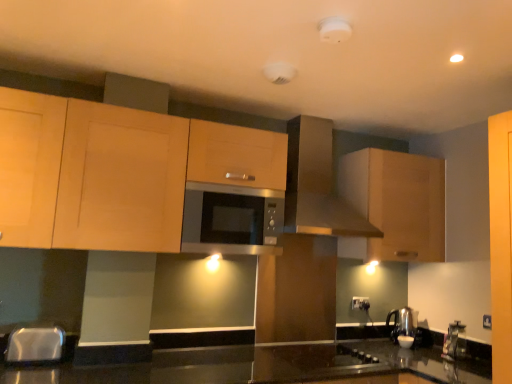
The height and width of the screenshot is (384, 512). What do you see at coordinates (116, 172) in the screenshot? I see `light wood cabinet at upper center, the second cabinetry positioned from the right` at bounding box center [116, 172].

You are a GUI agent. You are given a task and a screenshot of the screen. Output one action in this format:
    pyautogui.click(x=<x>, y=<y>)
    Task: Click on the matte brown range hood at upper center
    The width and height of the screenshot is (512, 384).
    Given the screenshot: What is the action you would take?
    pyautogui.click(x=317, y=184)

Describe the element at coordinates (405, 341) in the screenshot. I see `white glossy kettle at lower right` at that location.

What is the approximate height of matte wood cabinet at upper right, placed as the second cabinetry when sorted from left to right?

It is 29.44 inches.

This screenshot has height=384, width=512. What are the coordinates of `light wood cabinet at upper center, which is the first cabinetry from left to right` in the screenshot? It's located at (116, 172).

From a real-world perspective, is satin silver microwave at center above or below light wood cabinet at upper center, which is the first cabinetry from left to right?

satin silver microwave at center is situated lower than light wood cabinet at upper center, which is the first cabinetry from left to right, in the real world.

Which of these two, satin silver microwave at center or light wood cabinet at upper center, which is the first cabinetry from left to right, stands taller?

With more height is light wood cabinet at upper center, which is the first cabinetry from left to right.

This screenshot has width=512, height=384. In order to click on microwave below the light wood cabinet at upper center, which is the first cabinetry from left to right (from the image's perspective) in this screenshot , I will do `click(231, 220)`.

From their relative heights in the image, would you say matte wood cabinet at upper right, which ranks as the first cabinetry in right-to-left order, is taller or shorter than white glossy kettle at lower right?

Considering their sizes, matte wood cabinet at upper right, which ranks as the first cabinetry in right-to-left order, has more height than white glossy kettle at lower right.

Which object is wider, matte wood cabinet at upper right, which ranks as the first cabinetry in right-to-left order, or white glossy kettle at lower right?

Wider between the two is matte wood cabinet at upper right, which ranks as the first cabinetry in right-to-left order.

Would you say matte wood cabinet at upper right, placed as the second cabinetry when sorted from left to right, is outside white glossy kettle at lower right?

Yes, matte wood cabinet at upper right, placed as the second cabinetry when sorted from left to right, is not within white glossy kettle at lower right.

Does matte wood cabinet at upper right, placed as the second cabinetry when sorted from left to right, lie behind white glossy kettle at lower right?

No, matte wood cabinet at upper right, placed as the second cabinetry when sorted from left to right, is closer to the viewer.

The width and height of the screenshot is (512, 384). Identify the location of appliance on the right of light wood cabinet at upper center, which is the first cabinetry from left to right. [405, 341].

Does white glossy kettle at lower right have a lesser width compared to light wood cabinet at upper center, the second cabinetry positioned from the right?

Correct, the width of white glossy kettle at lower right is less than that of light wood cabinet at upper center, the second cabinetry positioned from the right.

Is white glossy kettle at lower right oriented away from light wood cabinet at upper center, the second cabinetry positioned from the right?

white glossy kettle at lower right does not have its back to light wood cabinet at upper center, the second cabinetry positioned from the right.

Consider the image. Is white glossy kettle at lower right smaller than light wood cabinet at upper center, the second cabinetry positioned from the right?

Indeed, white glossy kettle at lower right has a smaller size compared to light wood cabinet at upper center, the second cabinetry positioned from the right.

How many degrees apart are the facing directions of white plastic electric outlet at center and matte wood cabinet at upper right, which ranks as the first cabinetry in right-to-left order?

2.41 degrees separate the facing orientations of white plastic electric outlet at center and matte wood cabinet at upper right, which ranks as the first cabinetry in right-to-left order.

Is point (356, 296) closer to camera compared to point (441, 167)?

That is False.

From the image's perspective, is white plastic electric outlet at center positioned above or below matte wood cabinet at upper right, which ranks as the first cabinetry in right-to-left order?

white plastic electric outlet at center is situated lower than matte wood cabinet at upper right, which ranks as the first cabinetry in right-to-left order, in the image.

Looking at this image, considering the positions of objects white plastic electric outlet at center and matte wood cabinet at upper right, which ranks as the first cabinetry in right-to-left order, in the image provided, who is in front, white plastic electric outlet at center or matte wood cabinet at upper right, which ranks as the first cabinetry in right-to-left order,?

matte wood cabinet at upper right, which ranks as the first cabinetry in right-to-left order, is closer to the camera.

Is satin silver microwave at center oriented away from white glossy kettle at lower right?

No.

Looking at this image, is white glossy kettle at lower right surrounded by satin silver microwave at center?

No, white glossy kettle at lower right is not a part of satin silver microwave at center.

From the image's perspective, is satin silver microwave at center below white glossy kettle at lower right?

Actually, satin silver microwave at center appears above white glossy kettle at lower right in the image.

Considering the sizes of objects satin silver microwave at center and white glossy kettle at lower right in the image provided, who is thinner, satin silver microwave at center or white glossy kettle at lower right?

white glossy kettle at lower right is thinner.

Is point (362, 309) positioned behind point (174, 241)?

Yes, point (362, 309) is farther from viewer.

Find the location of a particular element. The image size is (512, 384). electric outlet below the light wood cabinet at upper center, the second cabinetry positioned from the right (from a real-world perspective) is located at coordinates (360, 303).

Is white plastic electric outlet at center closer to the viewer compared to light wood cabinet at upper center, the second cabinetry positioned from the right?

No, white plastic electric outlet at center is further to the viewer.

From the image's perspective, is white plastic electric outlet at center over light wood cabinet at upper center, which is the first cabinetry from left to right?

No, from the image's perspective, white plastic electric outlet at center is not over light wood cabinet at upper center, which is the first cabinetry from left to right.

The height and width of the screenshot is (384, 512). I want to click on silver in front of the white glossy kettle at lower right, so click(35, 344).

Is white glossy kettle at lower right turned away from metallic stainless steel sink at lower left?

No, white glossy kettle at lower right's orientation is not away from metallic stainless steel sink at lower left.

From the image's perspective, is white glossy kettle at lower right beneath metallic stainless steel sink at lower left?

Correct, white glossy kettle at lower right appears lower than metallic stainless steel sink at lower left in the image.

How far apart are white glossy kettle at lower right and metallic stainless steel sink at lower left?

white glossy kettle at lower right and metallic stainless steel sink at lower left are 2.18 meters apart from each other.

I want to click on microwave that appears below the light wood cabinet at upper center, the second cabinetry positioned from the right (from the image's perspective), so click(231, 220).

From a real-world perspective, count 2nd cabinetrys upward from the white glossy kettle at lower right and point to it. Please provide its 2D coordinates.

[(395, 205)]

Based on their spatial positions, is satin silver microwave at center or light wood cabinet at upper center, which is the first cabinetry from left to right, closer to matte wood cabinet at upper right, placed as the second cabinetry when sorted from left to right?

Among the two, satin silver microwave at center is located nearer to matte wood cabinet at upper right, placed as the second cabinetry when sorted from left to right.

Looking at the image, which one is located closer to light wood cabinet at upper center, the second cabinetry positioned from the right, white glossy kettle at lower right or matte brown range hood at upper center?

matte brown range hood at upper center is positioned closer to the anchor light wood cabinet at upper center, the second cabinetry positioned from the right.

From the image, which object appears to be nearer to light wood cabinet at upper center, the second cabinetry positioned from the right, matte brown range hood at upper center or matte wood cabinet at upper right, placed as the second cabinetry when sorted from left to right?

The object closer to light wood cabinet at upper center, the second cabinetry positioned from the right, is matte brown range hood at upper center.

From the image, which object appears to be nearer to white glossy kettle at lower right, matte wood cabinet at upper right, placed as the second cabinetry when sorted from left to right, or light wood cabinet at upper center, the second cabinetry positioned from the right?

The object closer to white glossy kettle at lower right is matte wood cabinet at upper right, placed as the second cabinetry when sorted from left to right.

Looking at the image, which one is located further to white glossy kettle at lower right, matte wood cabinet at upper right, which ranks as the first cabinetry in right-to-left order, or matte brown range hood at upper center?

matte brown range hood at upper center.

Looking at the image, which one is located closer to light wood cabinet at upper center, the second cabinetry positioned from the right, white glossy kettle at lower right or matte wood cabinet at upper right, placed as the second cabinetry when sorted from left to right?

matte wood cabinet at upper right, placed as the second cabinetry when sorted from left to right.

Looking at the image, which one is located closer to white glossy kettle at lower right, matte wood cabinet at upper right, which ranks as the first cabinetry in right-to-left order, or satin silver microwave at center?

Among the two, matte wood cabinet at upper right, which ranks as the first cabinetry in right-to-left order, is located nearer to white glossy kettle at lower right.

Looking at the image, which one is located closer to matte brown range hood at upper center, metallic stainless steel sink at lower left or white plastic electric outlet at center?

The object closer to matte brown range hood at upper center is white plastic electric outlet at center.

Where is `cabinetry between metallic stainless steel sink at lower left and matte wood cabinet at upper right, placed as the second cabinetry when sorted from left to right, in the horizontal direction`? The width and height of the screenshot is (512, 384). cabinetry between metallic stainless steel sink at lower left and matte wood cabinet at upper right, placed as the second cabinetry when sorted from left to right, in the horizontal direction is located at coordinates (116, 172).

Where is `kitchen appliance between satin silver microwave at center and white plastic electric outlet at center in the horizontal direction`? The height and width of the screenshot is (384, 512). kitchen appliance between satin silver microwave at center and white plastic electric outlet at center in the horizontal direction is located at coordinates (317, 184).

Where is `kitchen appliance situated between light wood cabinet at upper center, which is the first cabinetry from left to right, and white glossy kettle at lower right from left to right`? kitchen appliance situated between light wood cabinet at upper center, which is the first cabinetry from left to right, and white glossy kettle at lower right from left to right is located at coordinates (317, 184).

I want to click on microwave located between metallic stainless steel sink at lower left and white glossy kettle at lower right in the left-right direction, so click(231, 220).